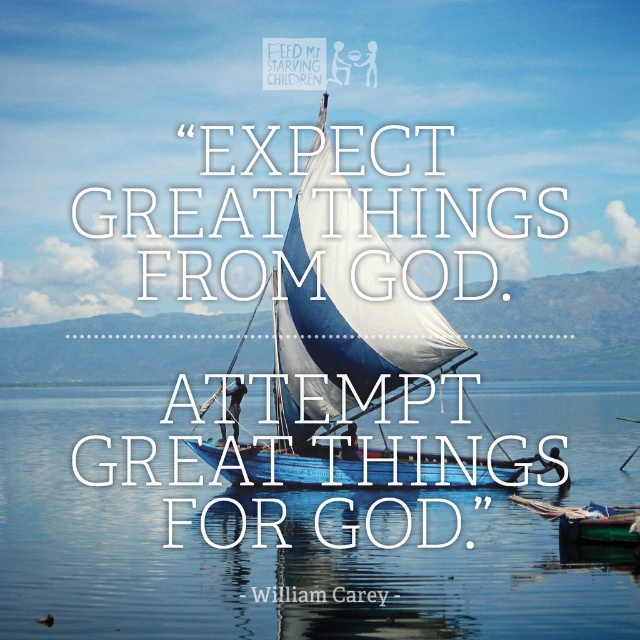
Question: Does transparent blue water at center appear on the right side of blue fabric sailboat at center?

Choices:
 (A) no
 (B) yes

Answer: (A)

Question: Which point appears farthest from the camera in this image?

Choices:
 (A) (61, 560)
 (B) (500, 474)

Answer: (B)

Question: Does transparent blue water at center come in front of blue fabric sailboat at center?

Choices:
 (A) yes
 (B) no

Answer: (A)

Question: Which of the following is the farthest from the observer?

Choices:
 (A) (298, 362)
 (B) (132, 616)

Answer: (A)

Question: From the image, what is the correct spatial relationship of transparent blue water at center in relation to blue fabric sailboat at center?

Choices:
 (A) right
 (B) left

Answer: (B)